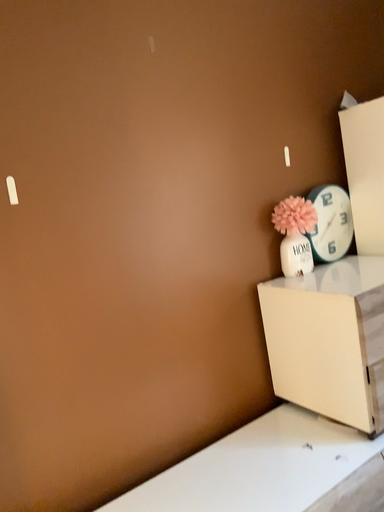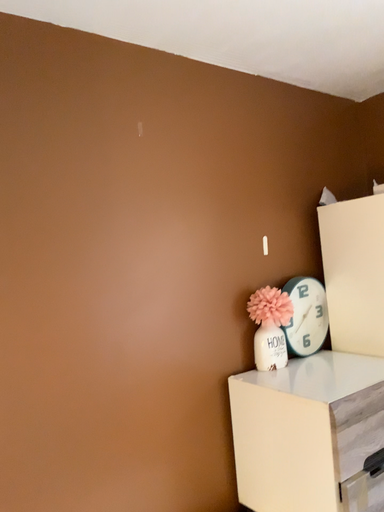
Question: Which way did the camera rotate in the video?

Choices:
 (A) rotated downward
 (B) rotated upward

Answer: (B)